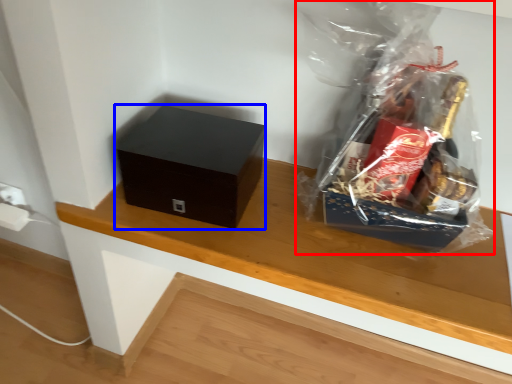
Question: Which of the following is the closest to the observer, plastic bag (highlighted by a red box) or box (highlighted by a blue box)?

Choices:
 (A) plastic bag
 (B) box

Answer: (A)